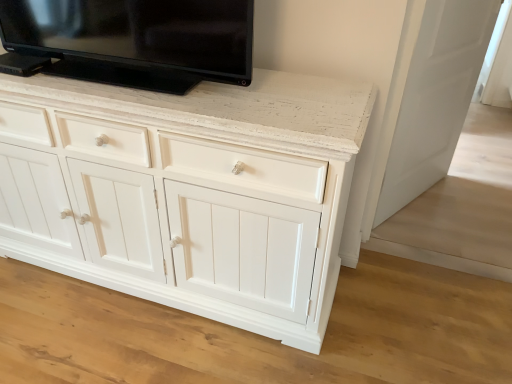
What is the approximate width of white glossy door at right?

5.60 inches.

The width and height of the screenshot is (512, 384). Describe the element at coordinates (432, 97) in the screenshot. I see `white glossy door at right` at that location.

I want to click on white glossy door at right, so click(x=432, y=97).

This screenshot has height=384, width=512. Describe the element at coordinates (132, 41) in the screenshot. I see `black glossy tv at upper center` at that location.

You are a GUI agent. You are given a task and a screenshot of the screen. Output one action in this format:
    pyautogui.click(x=<x>, y=<y>)
    Task: Click on the black glossy tv at upper center
    This screenshot has height=384, width=512.
    Given the screenshot: What is the action you would take?
    pyautogui.click(x=132, y=41)

Where is `white glossy door at right`? white glossy door at right is located at coordinates (432, 97).

Which is more to the right, white glossy door at right or black glossy tv at upper center?

white glossy door at right.

Is the depth of white glossy door at right less than that of black glossy tv at upper center?

No, it is behind black glossy tv at upper center.

Which is further, (393, 178) or (152, 36)?

The point (393, 178) is behind.

From the image's perspective, which one is positioned lower, white glossy door at right or black glossy tv at upper center?

From the image's view, white glossy door at right is below.

From a real-world perspective, is white glossy door at right on top of black glossy tv at upper center?

No, from a real-world perspective, white glossy door at right is not above black glossy tv at upper center.

Considering the sizes of objects white glossy door at right and black glossy tv at upper center in the image provided, who is wider, white glossy door at right or black glossy tv at upper center?

Wider between the two is black glossy tv at upper center.

Considering the relative sizes of white glossy door at right and black glossy tv at upper center in the image provided, is white glossy door at right shorter than black glossy tv at upper center?

No, white glossy door at right is not shorter than black glossy tv at upper center.

Between white glossy door at right and black glossy tv at upper center, which one has larger size?

With larger size is white glossy door at right.

Choose the correct answer: Is white glossy door at right inside black glossy tv at upper center or outside it?

white glossy door at right is located beyond the bounds of black glossy tv at upper center.

Are white glossy door at right and black glossy tv at upper center making contact?

No, white glossy door at right is not touching black glossy tv at upper center.

Is white glossy door at right oriented towards black glossy tv at upper center?

No, white glossy door at right is not aimed at black glossy tv at upper center.

What's the angular difference between white glossy door at right and black glossy tv at upper center's facing directions?

They differ by 59.9 degrees in their facing directions.

The width and height of the screenshot is (512, 384). In order to click on television on the left of the white glossy door at right in this screenshot , I will do `click(132, 41)`.

Can you confirm if black glossy tv at upper center is positioned to the left of white glossy door at right?

Yes.

Is black glossy tv at upper center further to camera compared to white glossy door at right?

No, black glossy tv at upper center is in front of white glossy door at right.

Does point (218, 59) come farther from viewer compared to point (435, 68)?

No, (218, 59) is closer to viewer.

From the image's perspective, is black glossy tv at upper center located above white glossy door at right?

Indeed, from the image's perspective, black glossy tv at upper center is shown above white glossy door at right.

From a real-world perspective, between black glossy tv at upper center and white glossy door at right, who is vertically higher?

From a 3D spatial view, black glossy tv at upper center is above.

Which object is wider, black glossy tv at upper center or white glossy door at right?

black glossy tv at upper center is wider.

Does black glossy tv at upper center have a lesser height compared to white glossy door at right?

Correct, black glossy tv at upper center is not as tall as white glossy door at right.

Between black glossy tv at upper center and white glossy door at right, which one has larger size?

white glossy door at right is bigger.

Is black glossy tv at upper center outside of white glossy door at right?

Absolutely, black glossy tv at upper center is external to white glossy door at right.

Is black glossy tv at upper center far away from white glossy door at right?

Yes, black glossy tv at upper center is far from white glossy door at right.

In the scene shown: Is black glossy tv at upper center facing towards white glossy door at right?

No.

Can you tell me how much black glossy tv at upper center and white glossy door at right differ in facing direction?

The angle between the facing direction of black glossy tv at upper center and the facing direction of white glossy door at right is 59.9 degrees.

How much distance is there between black glossy tv at upper center and white glossy door at right?

black glossy tv at upper center and white glossy door at right are 1.11 meters apart from each other.

You are a GUI agent. You are given a task and a screenshot of the screen. Output one action in this format:
    pyautogui.click(x=<x>, y=<y>)
    Task: Click on the television on the left of white glossy door at right
    Image resolution: width=512 pixels, height=384 pixels.
    Given the screenshot: What is the action you would take?
    pyautogui.click(x=132, y=41)

The image size is (512, 384). In order to click on television located above the white glossy door at right (from a real-world perspective) in this screenshot , I will do `click(132, 41)`.

At what (x,y) coordinates should I click in order to perform the action: click on television above the white glossy door at right (from the image's perspective). Please return your answer as a coordinate pair (x, y). The width and height of the screenshot is (512, 384). Looking at the image, I should click on (132, 41).